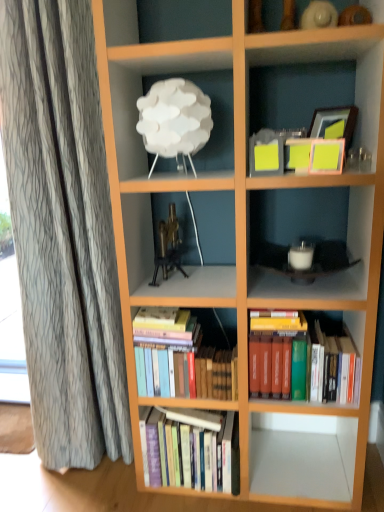
Describe the element at coordinates (168, 247) in the screenshot. I see `gold metallic tripod at center` at that location.

What do you see at coordinates (174, 120) in the screenshot?
I see `white matte lamp at upper left` at bounding box center [174, 120].

Identify the location of hardcover books at center, which is the third book in bottom-to-top order. This screenshot has height=512, width=384. (303, 359).

What is the approximate width of hardcover books at center, which is the second book in bottom-to-top order?

6.59 inches.

At what (x,y) coordinates should I click in order to perform the action: click on gold metallic tripod at center. Please return your answer as a coordinate pair (x, y). This screenshot has height=512, width=384. Looking at the image, I should click on (168, 247).

From the image's perspective, is white matte lamp at upper left located above or below gold metallic tripod at center?

white matte lamp at upper left is situated higher than gold metallic tripod at center in the image.

Which object is closer to the camera taking this photo, white matte lamp at upper left or gold metallic tripod at center?

white matte lamp at upper left is more forward.

Considering the sizes of objects white matte lamp at upper left and gold metallic tripod at center in the image provided, who is taller, white matte lamp at upper left or gold metallic tripod at center?

Standing taller between the two is white matte lamp at upper left.

From the image's perspective, which is below, wooden picture frame at upper right or white matte lamp at upper left?

white matte lamp at upper left appears lower in the image.

Who is smaller, wooden picture frame at upper right or white matte lamp at upper left?

Smaller between the two is wooden picture frame at upper right.

Looking at this image, is wooden picture frame at upper right positioned beyond the bounds of white matte lamp at upper left?

wooden picture frame at upper right is positioned outside white matte lamp at upper left.

In the scene shown: Which point is more forward, [331,115] or [211,395]?

Positioned in front is point [331,115].

From a real-world perspective, is wooden picture frame at upper right on top of hardcover books at center, arranged as the second book when viewed from the top?

Yes, from a real-world perspective, wooden picture frame at upper right is over hardcover books at center, arranged as the second book when viewed from the top

Based on the photo, considering the relative sizes of wooden picture frame at upper right and hardcover books at center, arranged as the second book when viewed from the top, in the image provided, is wooden picture frame at upper right smaller than hardcover books at center, arranged as the second book when viewed from the top,?

Yes.

Who is taller, wooden picture frame at upper right or hardcover books at center, which is the second book in bottom-to-top order?

Standing taller between the two is hardcover books at center, which is the second book in bottom-to-top order.

Considering the positions of objects white matte lamp at upper left and hardcover books at center, which is counted as the first book, starting from the top, in the image provided, who is more to the right, white matte lamp at upper left or hardcover books at center, which is counted as the first book, starting from the top,?

hardcover books at center, which is counted as the first book, starting from the top, is more to the right.

Which of these two, white matte lamp at upper left or hardcover books at center, which is the third book in bottom-to-top order, stands taller?

hardcover books at center, which is the third book in bottom-to-top order, is taller.

Is point (152, 93) closer to camera compared to point (343, 379)?

Yes, it is in front of point (343, 379).

Which is more to the right, hardcover books at center, which is the second book in bottom-to-top order, or white matte lamp at upper left?

From the viewer's perspective, hardcover books at center, which is the second book in bottom-to-top order, appears more on the right side.

Could you tell me if hardcover books at center, which is the second book in bottom-to-top order, is turned towards white matte lamp at upper left?

No, hardcover books at center, which is the second book in bottom-to-top order, is not turned towards white matte lamp at upper left.

Between hardcover books at center, which is the second book in bottom-to-top order, and white matte lamp at upper left, which one has more height?

Standing taller between the two is hardcover books at center, which is the second book in bottom-to-top order.

The width and height of the screenshot is (384, 512). Find the location of `lamp positioned vertically above the hardcover books at center, which is the second book in bottom-to-top order (from a real-world perspective)`. lamp positioned vertically above the hardcover books at center, which is the second book in bottom-to-top order (from a real-world perspective) is located at coordinates (174, 120).

Is point (308, 355) positioned behind point (178, 86)?

Yes, point (308, 355) is farther from viewer.

Relative to white matte lamp at upper left, is hardcover books at center, which is the third book in bottom-to-top order, in front or behind?

hardcover books at center, which is the third book in bottom-to-top order, is behind white matte lamp at upper left.

Is hardcover books at center, which is the third book in bottom-to-top order, at the right side of white matte lamp at upper left?

Yes.

Considering the relative sizes of hardcover books at center, which is counted as the first book, starting from the top, and white matte lamp at upper left in the image provided, is hardcover books at center, which is counted as the first book, starting from the top, wider than white matte lamp at upper left?

Correct, the width of hardcover books at center, which is counted as the first book, starting from the top, exceeds that of white matte lamp at upper left.

Can you tell me how much hardcover books at center, marked as the third book in a top-to-bottom arrangement, and hardcover books at center, which is counted as the first book, starting from the top, differ in facing direction?

3.2 degrees separate the facing orientations of hardcover books at center, marked as the third book in a top-to-bottom arrangement, and hardcover books at center, which is counted as the first book, starting from the top.

Does hardcover books at center, which is the first book in bottom-to-top order, have a greater width compared to hardcover books at center, which is the third book in bottom-to-top order?

No, hardcover books at center, which is the first book in bottom-to-top order, is not wider than hardcover books at center, which is the third book in bottom-to-top order.

Is hardcover books at center, which is the first book in bottom-to-top order, completely or partially outside of hardcover books at center, which is counted as the first book, starting from the top?

Indeed, hardcover books at center, which is the first book in bottom-to-top order, is completely outside hardcover books at center, which is counted as the first book, starting from the top.

Is hardcover books at center, marked as the third book in a top-to-bottom arrangement, positioned with its back to hardcover books at center, which is the third book in bottom-to-top order?

That's not correct — hardcover books at center, marked as the third book in a top-to-bottom arrangement, is not looking away from hardcover books at center, which is the third book in bottom-to-top order.

Where is `lamp that appears on the right of gold metallic tripod at center`? The width and height of the screenshot is (384, 512). lamp that appears on the right of gold metallic tripod at center is located at coordinates (174, 120).

Identify the location of picture frame above the white matte lamp at upper left (from the image's perspective). (334, 123).

Based on their spatial positions, is hardcover books at center, which is the second book in bottom-to-top order, or hardcover books at center, which is the third book in bottom-to-top order, further from gold metallic tripod at center?

Based on the image, hardcover books at center, which is the third book in bottom-to-top order, appears to be further to gold metallic tripod at center.

Based on their spatial positions, is hardcover books at center, which is the third book in bottom-to-top order, or white matte lamp at upper left closer to hardcover books at center, marked as the third book in a top-to-bottom arrangement?

Among the two, hardcover books at center, which is the third book in bottom-to-top order, is located nearer to hardcover books at center, marked as the third book in a top-to-bottom arrangement.

From the image, which object appears to be farther from gold metallic tripod at center, hardcover books at center, which is the first book in bottom-to-top order, or hardcover books at center, which is counted as the first book, starting from the top?

The object further to gold metallic tripod at center is hardcover books at center, which is the first book in bottom-to-top order.

When comparing their distances from hardcover books at center, which is the second book in bottom-to-top order, does white matte lamp at upper left or gold metallic tripod at center seem further?

white matte lamp at upper left is positioned further to the anchor hardcover books at center, which is the second book in bottom-to-top order.

Which object lies nearer to the anchor point hardcover books at center, which is counted as the first book, starting from the top, gold metallic tripod at center or hardcover books at center, which is the first book in bottom-to-top order?

hardcover books at center, which is the first book in bottom-to-top order, lies closer to hardcover books at center, which is counted as the first book, starting from the top, than the other object.

In the scene shown: Considering their positions, is wooden picture frame at upper right positioned further to hardcover books at center, which is the third book in bottom-to-top order, than hardcover books at center, which is the second book in bottom-to-top order?

Among the two, wooden picture frame at upper right is located further to hardcover books at center, which is the third book in bottom-to-top order.

Estimate the real-world distances between objects in this image. Which object is further from hardcover books at center, which is counted as the first book, starting from the top, white matte lamp at upper left or hardcover books at center, arranged as the second book when viewed from the top?

white matte lamp at upper left.

Based on their spatial positions, is white matte lamp at upper left or hardcover books at center, which is the first book in bottom-to-top order, further from wooden picture frame at upper right?

Among the two, hardcover books at center, which is the first book in bottom-to-top order, is located further to wooden picture frame at upper right.

Where is `lamp between gold metallic tripod at center and wooden picture frame at upper right from left to right`? Image resolution: width=384 pixels, height=512 pixels. lamp between gold metallic tripod at center and wooden picture frame at upper right from left to right is located at coordinates coord(174,120).

At what (x,y) coordinates should I click in order to perform the action: click on toy between white matte lamp at upper left and hardcover books at center, which is counted as the first book, starting from the top, in the up-down direction. Please return your answer as a coordinate pair (x, y). Image resolution: width=384 pixels, height=512 pixels. Looking at the image, I should click on (168, 247).

Locate an element on the screen. The image size is (384, 512). lamp between wooden picture frame at upper right and hardcover books at center, arranged as the second book when viewed from the top, in the vertical direction is located at coordinates (174, 120).

At what (x,y) coordinates should I click in order to perform the action: click on toy that lies between wooden picture frame at upper right and hardcover books at center, which is the second book in bottom-to-top order, from top to bottom. Please return your answer as a coordinate pair (x, y). The height and width of the screenshot is (512, 384). Looking at the image, I should click on (168, 247).